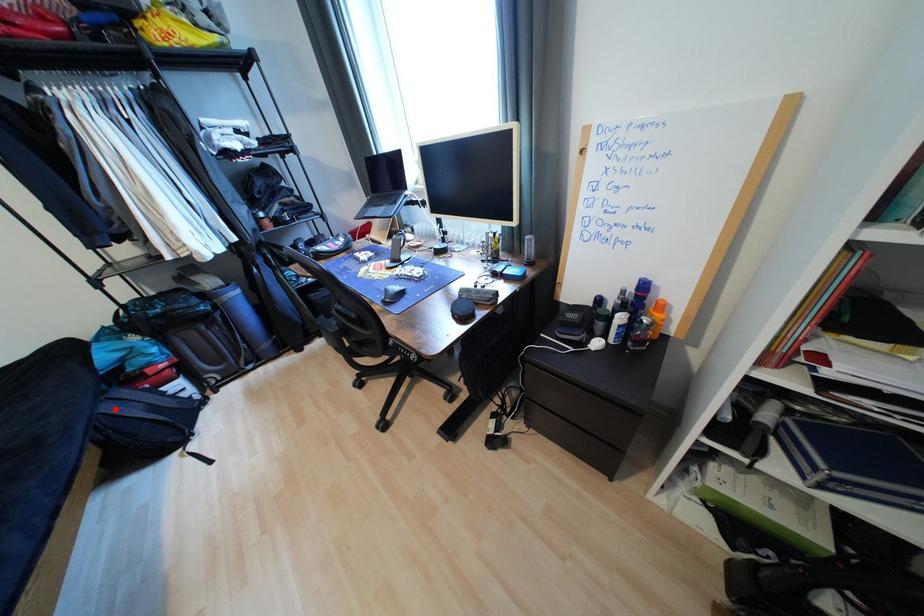
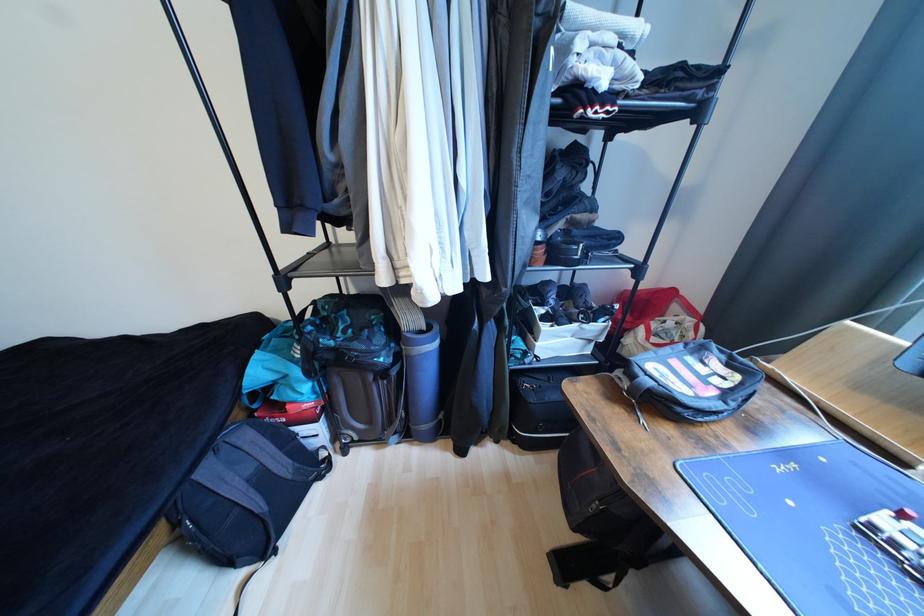
Where in the second image is the point corresponding to the highlighted location from the first image?

(215, 472)